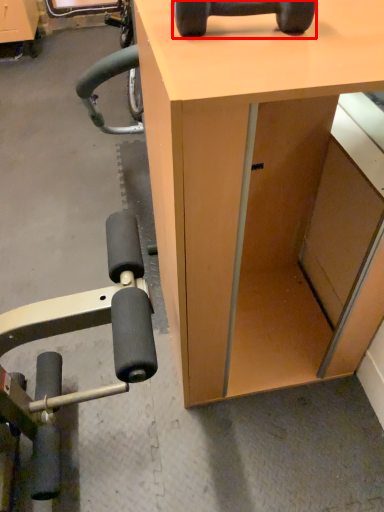
Question: From the image's perspective, where is dumbbell (annotated by the red box) located in relation to desk in the image?

Choices:
 (A) below
 (B) above

Answer: (B)